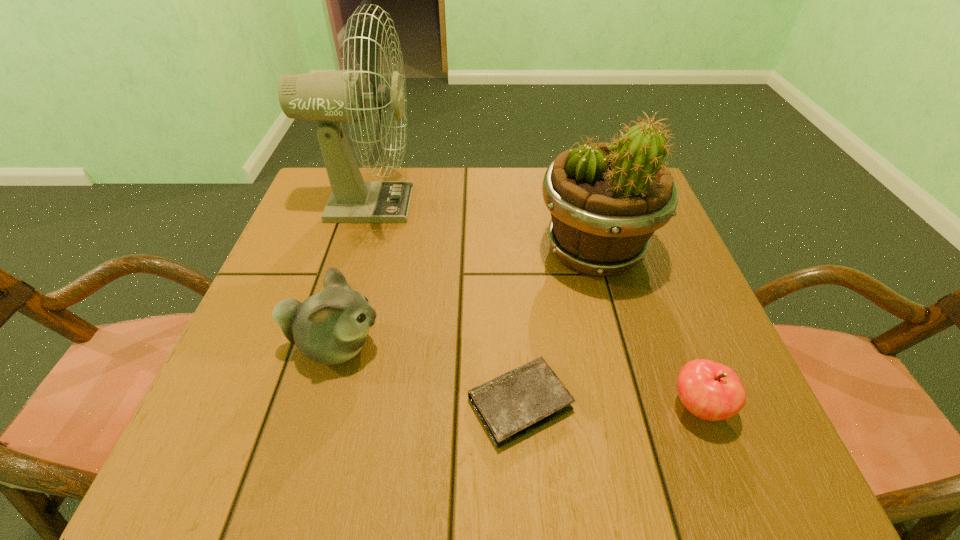
Image resolution: width=960 pixels, height=540 pixels. Identify the location of fan. (x=331, y=98).

This screenshot has width=960, height=540. I want to click on flowerpot, so click(x=606, y=200).

The height and width of the screenshot is (540, 960). Identify the location of the third tallest object. (330, 327).

Locate an element on the screen. This screenshot has height=540, width=960. the fourth tallest object is located at coordinates pyautogui.click(x=711, y=391).

Find the location of a particular element. the shortest object is located at coordinates (515, 403).

This screenshot has width=960, height=540. Identify the location of vacant space located 0.290m on the air flow direction of the tallest object. (531, 205).

Find the location of a particular element. free space located on the front of the fourth shortest object is located at coordinates (612, 319).

Where is `blank space located on the face of the hamster`? blank space located on the face of the hamster is located at coordinates (422, 346).

Identify the location of free space located 0.190m on the back of the apple. [x=657, y=297].

In order to click on free point located 0.060m on the back of the diary in this screenshot , I will do `click(516, 336)`.